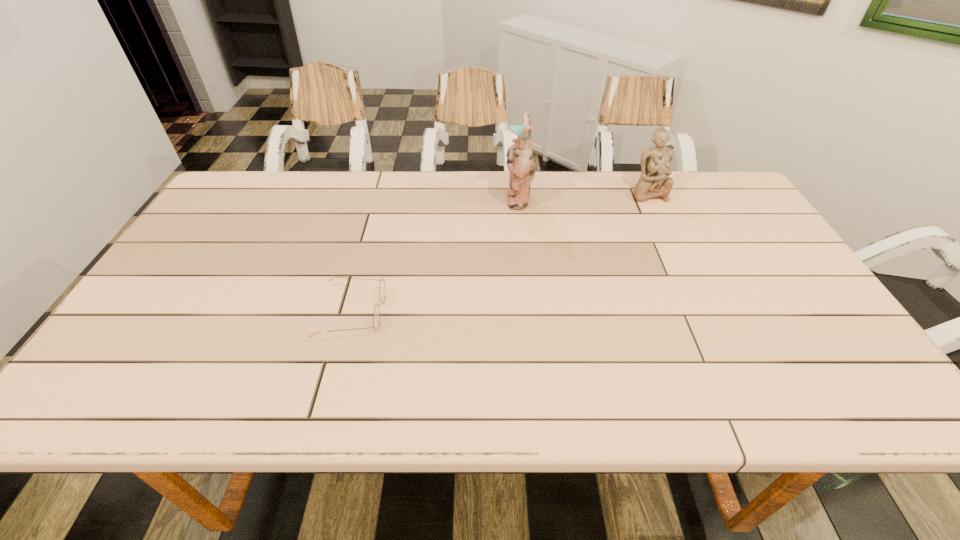
The image size is (960, 540). What are the coordinates of `vacant point located 0.090m on the temples of the shortest object` in the screenshot? It's located at (423, 313).

The width and height of the screenshot is (960, 540). What are the coordinates of `free space at the far edge of the desktop` in the screenshot? It's located at (420, 208).

Find the location of a particular element. This screenshot has height=540, width=960. free space at the near edge of the desktop is located at coordinates (512, 406).

Identify the location of free space at the left edge. The height and width of the screenshot is (540, 960). (192, 272).

At what (x,y) coordinates should I click in order to perform the action: click on free point at the right edge. Please return your answer as a coordinate pair (x, y). This screenshot has width=960, height=540. Looking at the image, I should click on (794, 276).

In the image, there is a desktop. Where is `vacant space at the near left corner`? vacant space at the near left corner is located at coordinates (102, 407).

Find the location of a particular element. vacant region at the far right corner of the desktop is located at coordinates (738, 201).

The image size is (960, 540). What are the coordinates of `vacant region between the taller figurine and the rightmost object` in the screenshot? It's located at (583, 196).

Where is `free point between the taller figurine and the shortest object`? Image resolution: width=960 pixels, height=540 pixels. free point between the taller figurine and the shortest object is located at coordinates coord(436,256).

You are a GUI agent. You are given a task and a screenshot of the screen. Output one action in this format:
    pyautogui.click(x=<x>, y=<y>)
    Task: Click on the vacant area that lies between the leftmost object and the taller figurine
    
    Given the screenshot: What is the action you would take?
    pyautogui.click(x=436, y=256)